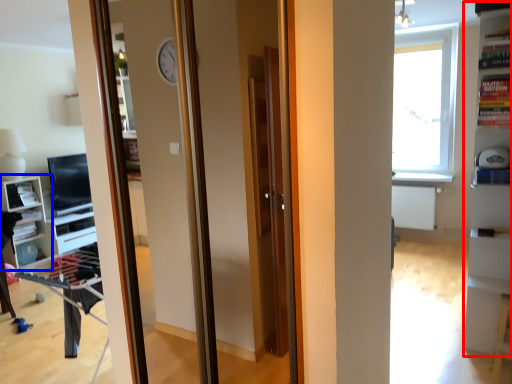
Question: Which point is further to the camera, bookshelf (highlighted by a red box) or shelf (highlighted by a blue box)?

Choices:
 (A) bookshelf
 (B) shelf

Answer: (B)